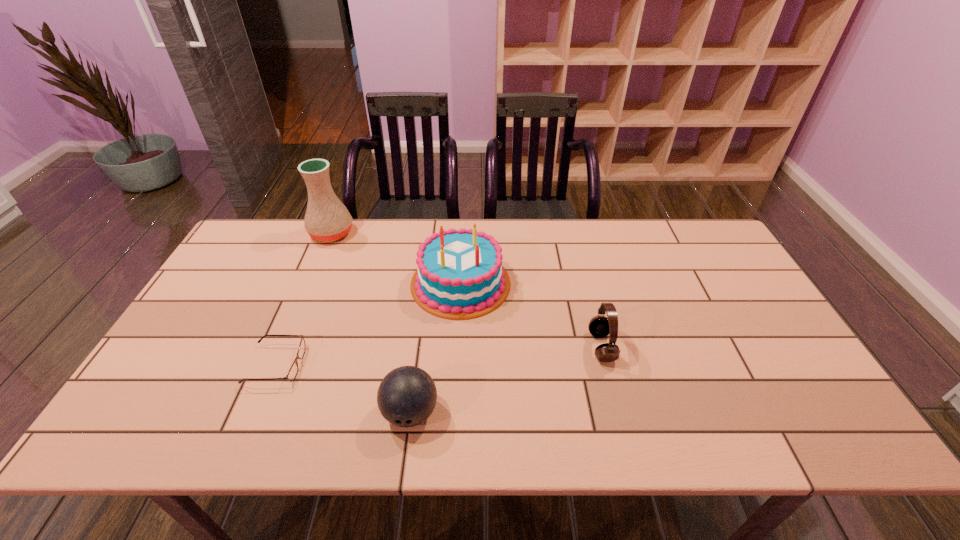
The height and width of the screenshot is (540, 960). Find the location of `the third closest object to the spectacles`. the third closest object to the spectacles is located at coordinates (327, 219).

Point out which object is positioned as the third nearest to the tallest object. Please provide its 2D coordinates. Your answer should be formatted as a tuple, i.e. [(x, y)], where the tuple contains the x and y coordinates of a point satisfying the conditions above.

[(406, 397)]

Where is `vacant point that satisfies the following two spatial constraints: 1. on the ear pads of the headset; 2. on the grip area of the bowling ball`? vacant point that satisfies the following two spatial constraints: 1. on the ear pads of the headset; 2. on the grip area of the bowling ball is located at coordinates (618, 413).